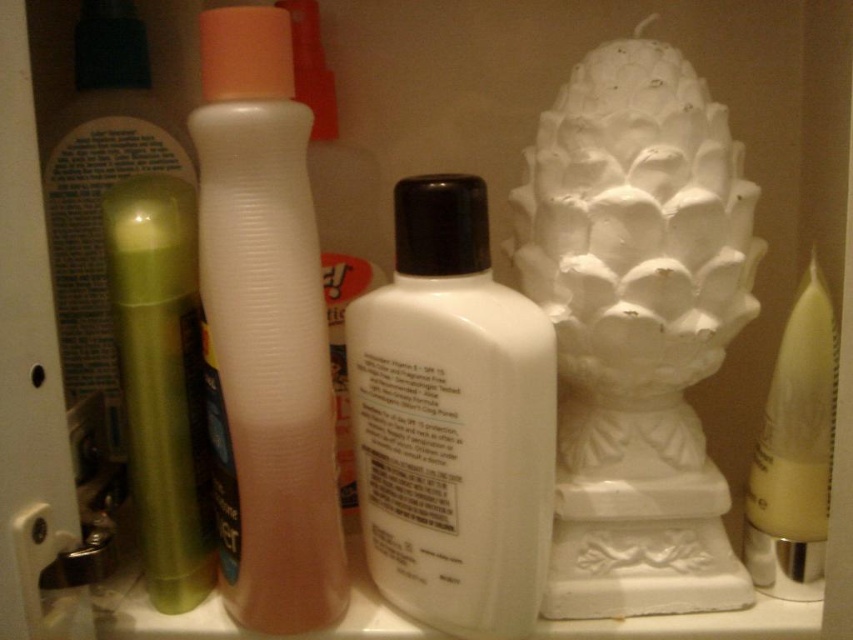
Which is more to the right, white ceramic sculpture at center right or yellow matte candle at right?

yellow matte candle at right is more to the right.

Does white ceramic sculpture at center right have a lesser width compared to yellow matte candle at right?

Incorrect, white ceramic sculpture at center right's width is not less than yellow matte candle at right's.

Where is `white ceramic sculpture at center right`? This screenshot has height=640, width=853. white ceramic sculpture at center right is located at coordinates (636, 324).

Can you confirm if white matte lotion at center is taller than green matte tube at left?

Yes, white matte lotion at center is taller than green matte tube at left.

Does white matte lotion at center have a lesser height compared to green matte tube at left?

No, white matte lotion at center is not shorter than green matte tube at left.

What do you see at coordinates (451, 420) in the screenshot? I see `white matte lotion at center` at bounding box center [451, 420].

The image size is (853, 640). Find the location of `white matte lotion at center`. white matte lotion at center is located at coordinates (451, 420).

Is translucent plastic lotion at center smaller than green matte tube at left?

Incorrect, translucent plastic lotion at center is not smaller in size than green matte tube at left.

The image size is (853, 640). What are the coordinates of `translucent plastic lotion at center` in the screenshot? It's located at (265, 332).

This screenshot has height=640, width=853. Identify the location of translucent plastic lotion at center. (265, 332).